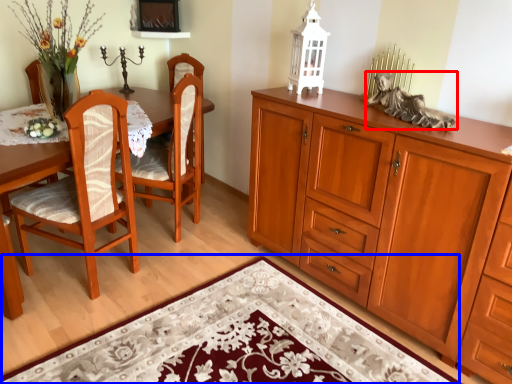
Question: Which object is further to the camera taking this photo, person (highlighted by a red box) or doormat (highlighted by a blue box)?

Choices:
 (A) person
 (B) doormat

Answer: (A)